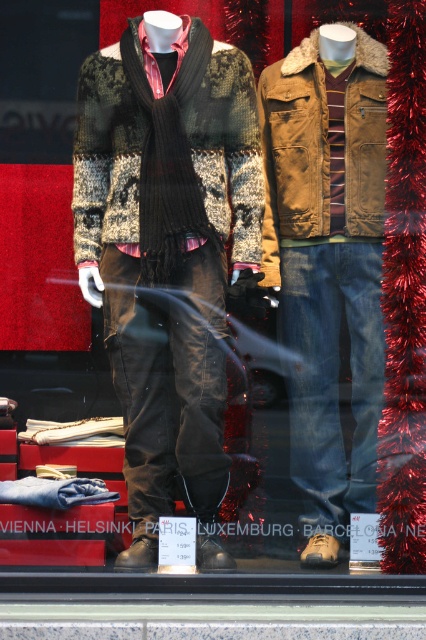
You are a customer looking at the retail display window. You notice the denim jeans at center and the black ribbed scarf at center. Which item is closer to you?

The denim jeans at center is closer to you because it is further to the viewer than the black ribbed scarf at center.

You are a customer standing in front of the retail display window. You want to locate the knit sweater at center. Based on its coordinates, where would you look in the window display?

The knit sweater at center is located at coordinates point [166,252], which is near the center of the display window.